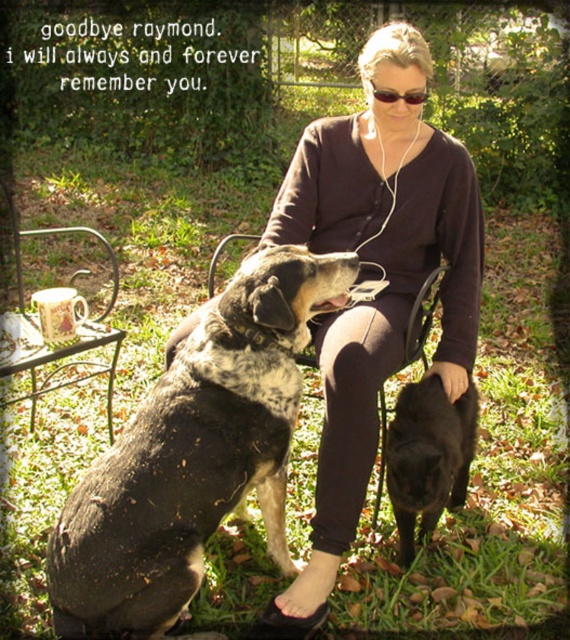
Is black matte dog at lower right shorter than sunglasses at center?

No.

Is point (451, 460) in front of point (382, 100)?

Yes, it is in front of point (382, 100).

Find the location of `black matte dog at lower right`. black matte dog at lower right is located at coordinates (428, 456).

Between matte brown shirt at center and speckled fur dog at center, which one is positioned lower?

Positioned lower is speckled fur dog at center.

Is matte brown shirt at center behind speckled fur dog at center?

That is True.

Between point (469, 346) and point (327, 282), which one is positioned in front?

Positioned in front is point (327, 282).

Where is `matte brown shirt at center`? Image resolution: width=570 pixels, height=640 pixels. matte brown shirt at center is located at coordinates (372, 278).

Does point (311, 276) come closer to viewer compared to point (429, 376)?

That is True.

Measure the distance between speckled fur dog at center and black matte dog at lower right.

speckled fur dog at center is 25.18 inches away from black matte dog at lower right.

Which is in front, point (83, 540) or point (437, 435)?

Point (83, 540) is in front.

Find the location of a particular element. speckled fur dog at center is located at coordinates (193, 454).